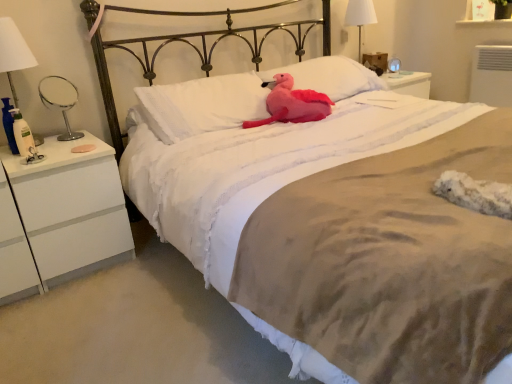
Question: Is white matte/finish nightstand at left to the left of white fabric lampshade at upper right from the viewer's perspective?

Choices:
 (A) yes
 (B) no

Answer: (A)

Question: Is white matte/finish nightstand at left next to white fabric lampshade at upper right and touching it?

Choices:
 (A) no
 (B) yes

Answer: (A)

Question: Does white matte/finish nightstand at left have a smaller size compared to white fabric lampshade at upper right?

Choices:
 (A) no
 (B) yes

Answer: (A)

Question: Could white fabric lampshade at upper right be considered to be inside white matte/finish nightstand at left?

Choices:
 (A) yes
 (B) no

Answer: (B)

Question: Is white matte/finish nightstand at left shorter than white fabric lampshade at upper right?

Choices:
 (A) no
 (B) yes

Answer: (A)

Question: From a real-world perspective, is white matte/finish nightstand at left below white fabric lampshade at upper right?

Choices:
 (A) yes
 (B) no

Answer: (A)

Question: Is white soft pillow at center, the second pillow viewed from the right, to the right of white soft pillow at center, positioned as the first pillow in right-to-left order, from the viewer's perspective?

Choices:
 (A) yes
 (B) no

Answer: (B)

Question: Is white soft pillow at center, the second pillow viewed from the right, shorter than white soft pillow at center, which ranks as the 2th pillow in left-to-right order?

Choices:
 (A) yes
 (B) no

Answer: (B)

Question: From the image's perspective, would you say white soft pillow at center, the second pillow viewed from the right, is positioned over white soft pillow at center, positioned as the first pillow in right-to-left order?

Choices:
 (A) no
 (B) yes

Answer: (A)

Question: Can you confirm if white soft pillow at center, the second pillow viewed from the right, is bigger than white soft pillow at center, which ranks as the 2th pillow in left-to-right order?

Choices:
 (A) no
 (B) yes

Answer: (A)

Question: From a real-world perspective, is white soft pillow at center, the second pillow viewed from the right, positioned over white soft pillow at center, positioned as the first pillow in right-to-left order, based on gravity?

Choices:
 (A) yes
 (B) no

Answer: (A)

Question: Is white soft pillow at center, the second pillow viewed from the right, smaller than white soft pillow at center, which ranks as the 2th pillow in left-to-right order?

Choices:
 (A) no
 (B) yes

Answer: (B)

Question: Considering the relative sizes of white fabric lampshade at upper right and metallic silver mirror at left in the image provided, is white fabric lampshade at upper right shorter than metallic silver mirror at left?

Choices:
 (A) no
 (B) yes

Answer: (A)